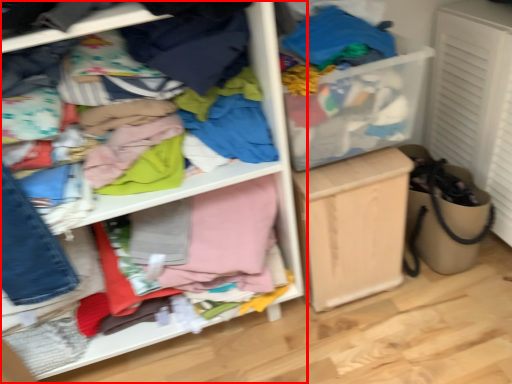
Question: From the image's perspective, what is the correct spatial relationship of shelf (annotated by the red box) in relation to cabinetry?

Choices:
 (A) above
 (B) below

Answer: (A)